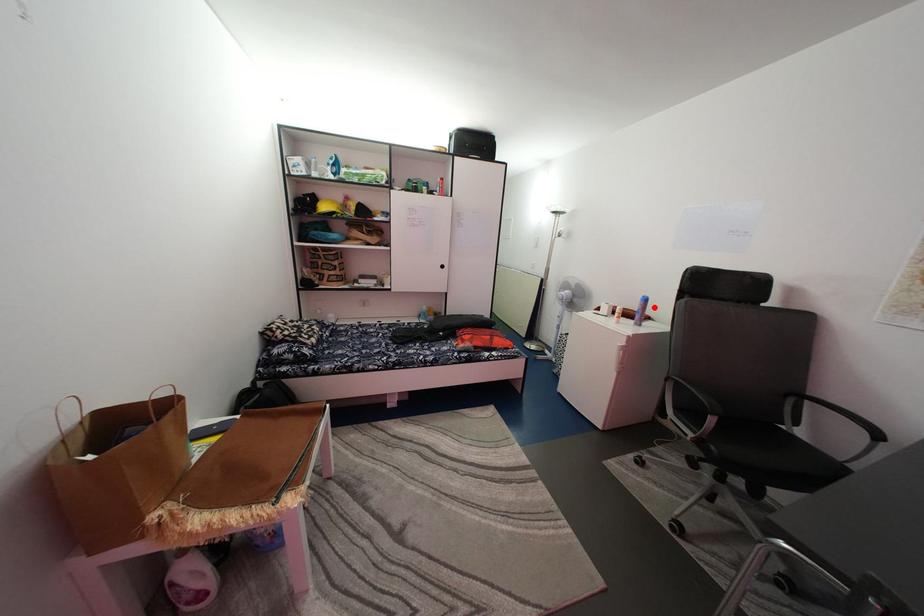
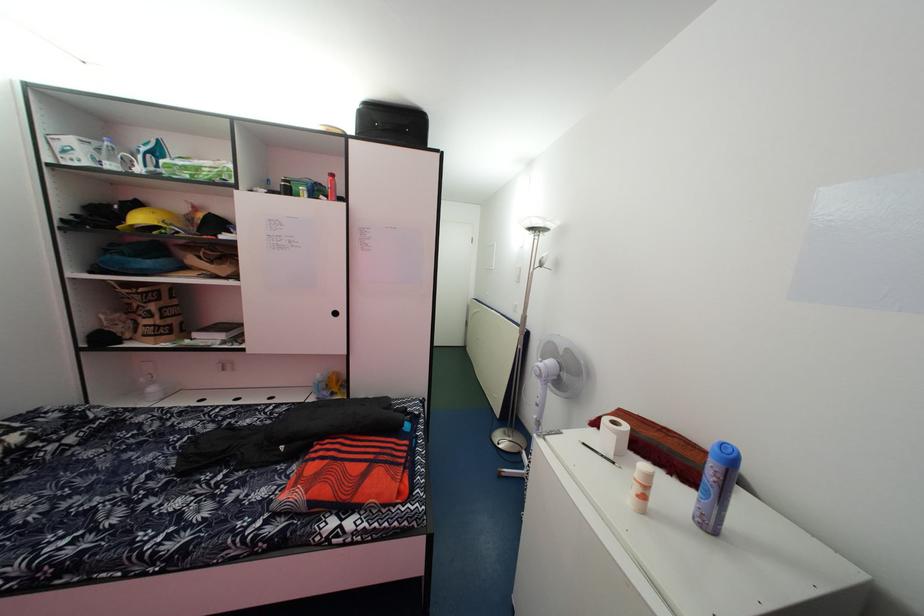
Find the pixel in the second image that matches the highlighted location in the first image.

(738, 466)